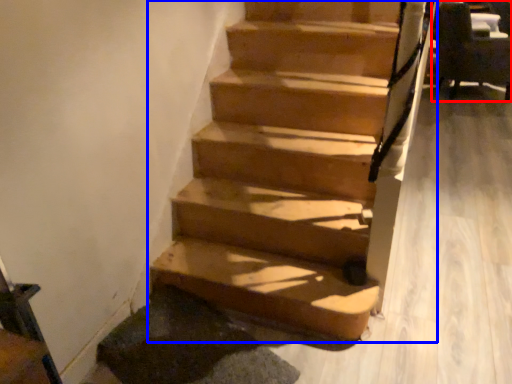
Question: Which object is closer to the camera taking this photo, armchair (highlighted by a red box) or stairs (highlighted by a blue box)?

Choices:
 (A) armchair
 (B) stairs

Answer: (B)